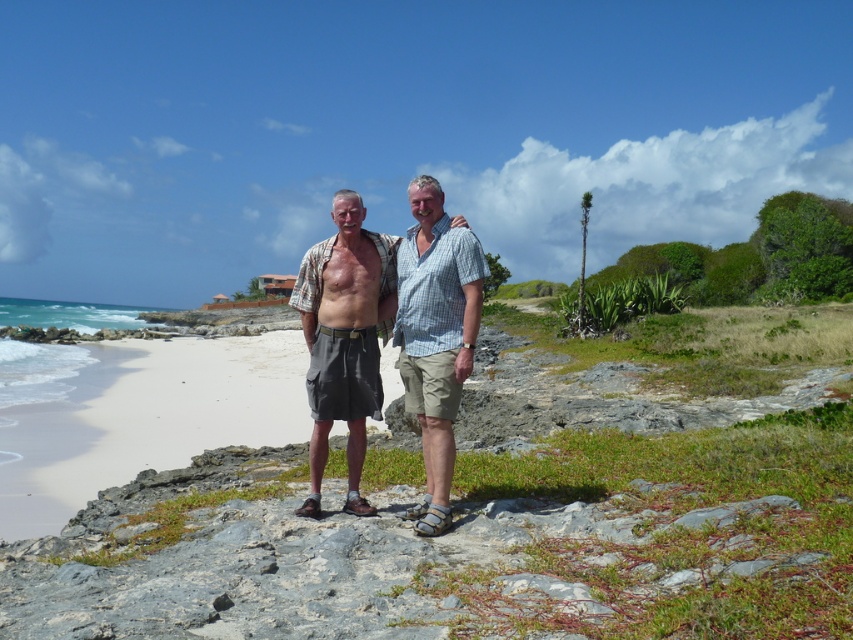
Is matte khaki shorts at center thinner than checkered fabric shirt at center?

In fact, matte khaki shorts at center might be wider than checkered fabric shirt at center.

Who is positioned more to the left, matte khaki shorts at center or checkered fabric shirt at center?

Positioned to the left is matte khaki shorts at center.

What do you see at coordinates (344, 337) in the screenshot? Image resolution: width=853 pixels, height=640 pixels. I see `matte khaki shorts at center` at bounding box center [344, 337].

This screenshot has height=640, width=853. Find the location of `matte khaki shorts at center`. matte khaki shorts at center is located at coordinates (344, 337).

Is point (291, 365) closer to camera compared to point (369, 342)?

No, (291, 365) is further to viewer.

Which is behind, point (766, 522) or point (341, 340)?

Point (341, 340)

The image size is (853, 640). In order to click on white sand beach at center in this screenshot , I will do 482,524.

Is white sand beach at center shorter than checkered fabric shirt at center?

In fact, white sand beach at center may be taller than checkered fabric shirt at center.

Does white sand beach at center have a lesser width compared to checkered fabric shirt at center?

No.

At what (x,y) coordinates should I click in order to perform the action: click on white sand beach at center. Please return your answer as a coordinate pair (x, y). The width and height of the screenshot is (853, 640). Looking at the image, I should click on (482, 524).

Where is `white sand beach at center`? Image resolution: width=853 pixels, height=640 pixels. white sand beach at center is located at coordinates (482, 524).